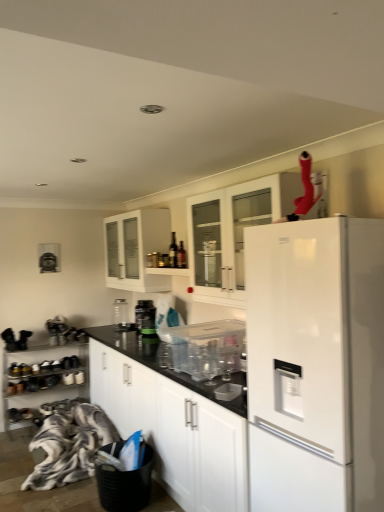
Question: Can you confirm if fluffy fabric blanket at lower left is wider than metallic silver shoe rack at lower left, the 1th cabinetry when ordered from bottom to top?

Choices:
 (A) yes
 (B) no

Answer: (A)

Question: Could metallic silver shoe rack at lower left, the fourth cabinetry when ordered from top to bottom, be considered to be inside fluffy fabric blanket at lower left?

Choices:
 (A) yes
 (B) no

Answer: (B)

Question: From a real-world perspective, is fluffy fabric blanket at lower left on metallic silver shoe rack at lower left, the 1th cabinetry when ordered from bottom to top?

Choices:
 (A) no
 (B) yes

Answer: (A)

Question: From the image's perspective, is fluffy fabric blanket at lower left over metallic silver shoe rack at lower left, the fourth cabinetry when ordered from top to bottom?

Choices:
 (A) no
 (B) yes

Answer: (A)

Question: From the image's perspective, is fluffy fabric blanket at lower left located beneath metallic silver shoe rack at lower left, the 1th cabinetry when ordered from bottom to top?

Choices:
 (A) no
 (B) yes

Answer: (B)

Question: Is white glass cabinet at upper center, the 4th cabinetry ordered from the bottom, inside the boundaries of fluffy fabric blanket at lower left, or outside?

Choices:
 (A) outside
 (B) inside

Answer: (A)

Question: In terms of width, does white glass cabinet at upper center, the 4th cabinetry ordered from the bottom, look wider or thinner when compared to fluffy fabric blanket at lower left?

Choices:
 (A) thin
 (B) wide

Answer: (A)

Question: Considering the positions of white glass cabinet at upper center, the 4th cabinetry ordered from the bottom, and fluffy fabric blanket at lower left in the image, is white glass cabinet at upper center, the 4th cabinetry ordered from the bottom, taller or shorter than fluffy fabric blanket at lower left?

Choices:
 (A) short
 (B) tall

Answer: (B)

Question: Is point (218, 244) positioned closer to the camera than point (31, 474)?

Choices:
 (A) closer
 (B) farther

Answer: (A)

Question: Considering their positions, is clear glass jar at center, acting as the third appliance starting from the right, located in front of or behind green matte jar at center, arranged as the second appliance when viewed from the right?

Choices:
 (A) behind
 (B) front

Answer: (A)

Question: Considering the positions of point (119, 329) and point (150, 309), is point (119, 329) closer or farther from the camera than point (150, 309)?

Choices:
 (A) farther
 (B) closer

Answer: (A)

Question: Looking at the image, does clear glass jar at center, the third appliance from the front, seem bigger or smaller compared to green matte jar at center, arranged as the second appliance when viewed from the right?

Choices:
 (A) small
 (B) big

Answer: (A)

Question: From a real-world perspective, is clear glass jar at center, the third appliance from the front, physically located above or below green matte jar at center, the 2th appliance when ordered from left to right?

Choices:
 (A) above
 (B) below

Answer: (A)

Question: Considering the positions of point (375, 421) and point (195, 329), is point (375, 421) closer or farther from the camera than point (195, 329)?

Choices:
 (A) farther
 (B) closer

Answer: (B)

Question: Is white matte refrigerator at right wider or thinner than transparent plastic container at center, which is counted as the third appliance, starting from the back?

Choices:
 (A) wide
 (B) thin

Answer: (A)